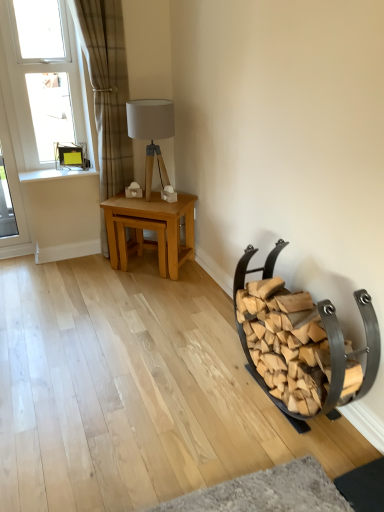
Where is `white plastic window at upper left`? white plastic window at upper left is located at coordinates (44, 78).

At what (x,y) coordinates should I click in order to perform the action: click on white plastic window at upper left. Please return your answer as a coordinate pair (x, y). The width and height of the screenshot is (384, 512). Looking at the image, I should click on (44, 78).

Is matte wood table lamp at center to the left or to the right of white plastic window at upper left in the image?

matte wood table lamp at center is positioned on white plastic window at upper left's right side.

From a real-world perspective, between matte wood table lamp at center and white plastic window at upper left, who is vertically lower?

matte wood table lamp at center.

Considering the relative sizes of matte wood table lamp at center and white plastic window at upper left in the image provided, is matte wood table lamp at center smaller than white plastic window at upper left?

Actually, matte wood table lamp at center might be larger than white plastic window at upper left.

Is matte wood table lamp at center inside the boundaries of plaid fabric curtain at left, or outside?

matte wood table lamp at center is located beyond the bounds of plaid fabric curtain at left.

Which object is closer to the camera taking this photo, matte wood table lamp at center or plaid fabric curtain at left?

plaid fabric curtain at left.

Which of these two, matte wood table lamp at center or plaid fabric curtain at left, is smaller?

matte wood table lamp at center.

Which is in front, point (159, 170) or point (124, 67)?

Point (124, 67)

What's the angular difference between light oak table at center and wooden firewood rack at lower right's facing directions?

light oak table at center and wooden firewood rack at lower right are facing 45 degrees away from each other.

Is light oak table at center oriented away from wooden firewood rack at lower right?

No, light oak table at center is not facing away from wooden firewood rack at lower right.

Is light oak table at center to the left or to the right of wooden firewood rack at lower right in the image?

Based on their positions, light oak table at center is located to the left of wooden firewood rack at lower right.

From the picture: Considering the sizes of light oak table at center and wooden firewood rack at lower right in the image, is light oak table at center taller or shorter than wooden firewood rack at lower right?

Considering their sizes, light oak table at center has less height than wooden firewood rack at lower right.

Is point (20, 42) farther from viewer compared to point (164, 214)?

Yes, point (20, 42) is behind point (164, 214).

Looking at this image, which object is closer to the camera taking this photo, white plastic window at upper left or light oak table at center?

white plastic window at upper left is closer to the camera.

Between white plastic window at upper left and light oak table at center, which one has larger width?

Wider between the two is light oak table at center.

Considering the sizes of objects white plastic window at upper left and light oak table at center in the image provided, who is shorter, white plastic window at upper left or light oak table at center?

light oak table at center is shorter.

Based on their sizes in the image, would you say plaid fabric curtain at left is bigger or smaller than wooden firewood rack at lower right?

In the image, plaid fabric curtain at left appears to be smaller than wooden firewood rack at lower right.

Is plaid fabric curtain at left at the left side of wooden firewood rack at lower right?

Yes.

Does point (113, 77) appear closer or farther from the camera than point (331, 404)?

Clearly, point (113, 77) is more distant from the camera than point (331, 404).

How many degrees apart are the facing directions of plaid fabric curtain at left and wooden firewood rack at lower right?

There is a 91.1-degree angle between the facing directions of plaid fabric curtain at left and wooden firewood rack at lower right.

Can you tell me how much wooden firewood rack at lower right and matte wood table lamp at center differ in facing direction?

The angular difference between wooden firewood rack at lower right and matte wood table lamp at center is 45.8 degrees.

Where is `rocking chair that is in front of the matte wood table lamp at center`? This screenshot has height=512, width=384. rocking chair that is in front of the matte wood table lamp at center is located at coordinates (244, 281).

Is wooden firewood rack at lower right behind matte wood table lamp at center?

That is False.

Is white wood at upper left wider than wooden firewood rack at lower right?

No, white wood at upper left is not wider than wooden firewood rack at lower right.

Where is `window sill above the wooden firewood rack at lower right (from the image's perspective)`? This screenshot has width=384, height=512. window sill above the wooden firewood rack at lower right (from the image's perspective) is located at coordinates (55, 174).

Is white wood at upper left further to the viewer compared to wooden firewood rack at lower right?

Yes, white wood at upper left is further from the viewer.

Is point (60, 170) closer to camera compared to point (377, 345)?

No, (60, 170) is behind (377, 345).

Identify the location of table lamp in front of the white plastic window at upper left. (151, 133).

Find the location of a particular element. Image resolution: width=384 pixels, height=512 pixels. curtain above the matte wood table lamp at center (from a real-world perspective) is located at coordinates click(x=107, y=88).

Looking at the image, which one is located closer to white wood at upper left, matte wood table lamp at center or wooden firewood rack at lower right?

Among the two, matte wood table lamp at center is located nearer to white wood at upper left.

Which object lies nearer to the anchor point plaid fabric curtain at left, wooden firewood rack at lower right or white plastic window at upper left?

white plastic window at upper left lies closer to plaid fabric curtain at left than the other object.

Considering their positions, is matte wood table lamp at center positioned further to white plastic window at upper left than plaid fabric curtain at left?

The object further to white plastic window at upper left is matte wood table lamp at center.

Which object lies nearer to the anchor point matte wood table lamp at center, white wood at upper left or plaid fabric curtain at left?

plaid fabric curtain at left is closer to matte wood table lamp at center.

From the picture: Estimate the real-world distances between objects in this image. Which object is closer to white wood at upper left, light oak table at center or matte wood table lamp at center?

light oak table at center is closer to white wood at upper left.

When comparing their distances from light oak table at center, does white plastic window at upper left or wooden firewood rack at lower right seem closer?

wooden firewood rack at lower right lies closer to light oak table at center than the other object.

Looking at the image, which one is located further to wooden firewood rack at lower right, white wood at upper left or matte wood table lamp at center?

white wood at upper left is positioned further to the anchor wooden firewood rack at lower right.

Based on their spatial positions, is light oak table at center or white wood at upper left further from matte wood table lamp at center?

white wood at upper left is positioned further to the anchor matte wood table lamp at center.

Where is `table between white plastic window at upper left and wooden firewood rack at lower right from top to bottom`? The image size is (384, 512). table between white plastic window at upper left and wooden firewood rack at lower right from top to bottom is located at coordinates (150, 229).

Find the location of a particular element. window sill between white plastic window at upper left and matte wood table lamp at center from left to right is located at coordinates click(55, 174).

The height and width of the screenshot is (512, 384). I want to click on window sill between white plastic window at upper left and light oak table at center from top to bottom, so click(x=55, y=174).

Find the location of a particular element. The width and height of the screenshot is (384, 512). table lamp positioned between wooden firewood rack at lower right and white wood at upper left from near to far is located at coordinates (151, 133).